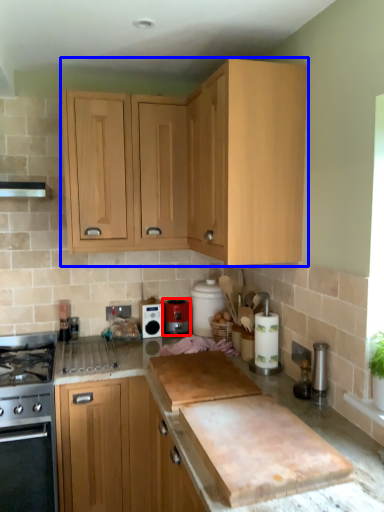
Question: Which of the following is the closest to the observer, kitchen appliance (highlighted by a red box) or cabinetry (highlighted by a blue box)?

Choices:
 (A) kitchen appliance
 (B) cabinetry

Answer: (B)